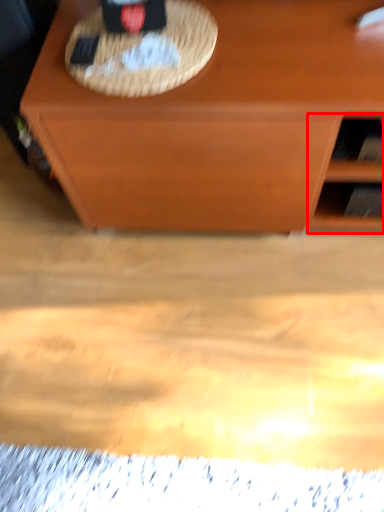
Question: From the image's perspective, where is shelf (annotated by the red box) located in relation to picnic basket in the image?

Choices:
 (A) below
 (B) above

Answer: (A)